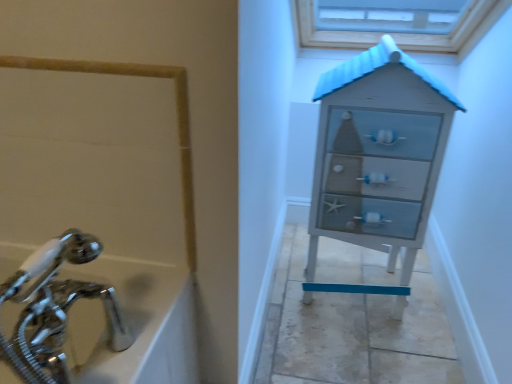
Image resolution: width=512 pixels, height=384 pixels. Find the location of `vacant region under distressed white chest of drawers at right (from a real-world perspective)`. vacant region under distressed white chest of drawers at right (from a real-world perspective) is located at coordinates (352, 302).